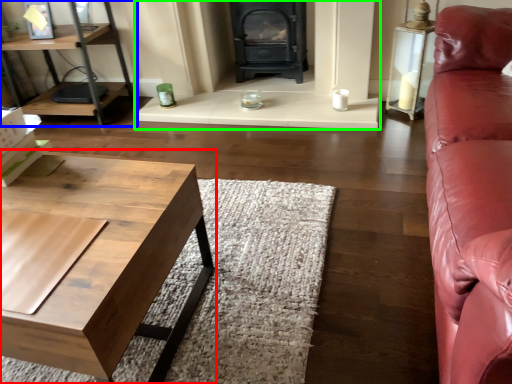
Question: Estimate the real-world distances between objects in this image. Which object is farther from coffee table (highlighted by a red box), shelf (highlighted by a blue box) or fireplace (highlighted by a green box)?

Choices:
 (A) shelf
 (B) fireplace

Answer: (A)